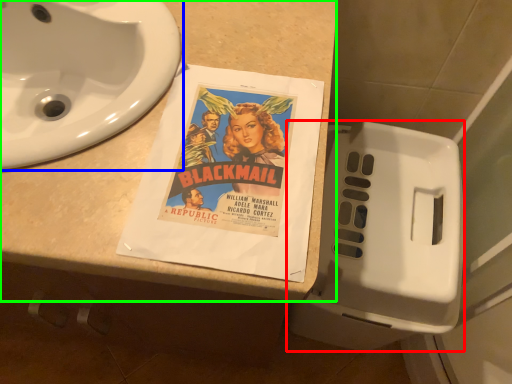
Question: Considering the real-world distances, which object is farthest from toilet (highlighted by a red box)? sink (highlighted by a blue box) or counter top (highlighted by a green box)?

Choices:
 (A) sink
 (B) counter top

Answer: (A)